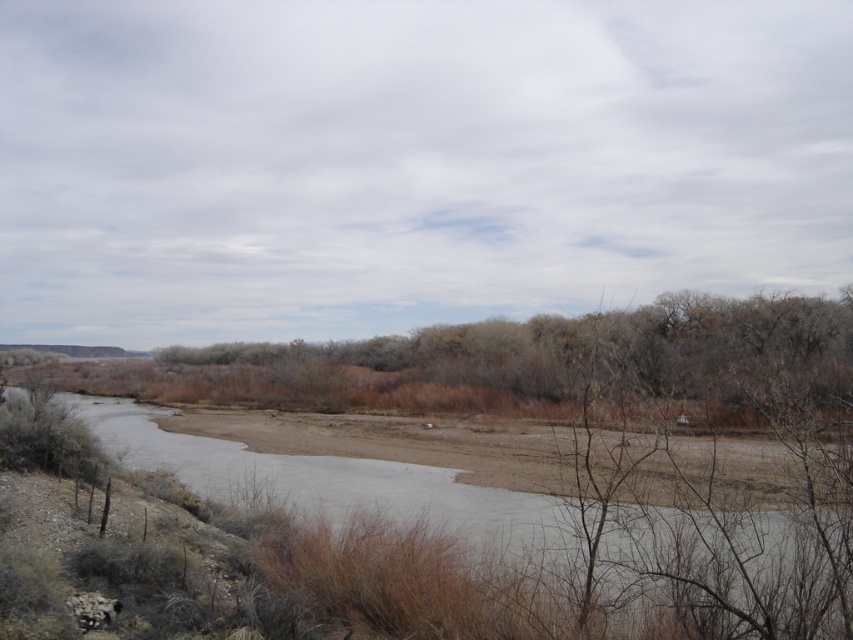
Which is more to the right, brown dirt at lower center or brown/dry grass at center?

brown dirt at lower center is more to the right.

Locate an element on the screen. The image size is (853, 640). brown dirt at lower center is located at coordinates (281, 552).

What are the coordinates of `brown dirt at lower center` in the screenshot? It's located at (281, 552).